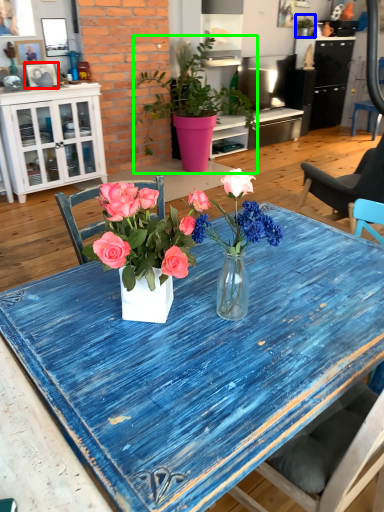
Question: Which object is the closest to the picture frame (highlighted by a red box)? Choose among these: houseplant (highlighted by a blue box) or houseplant (highlighted by a green box).

Choices:
 (A) houseplant
 (B) houseplant

Answer: (B)